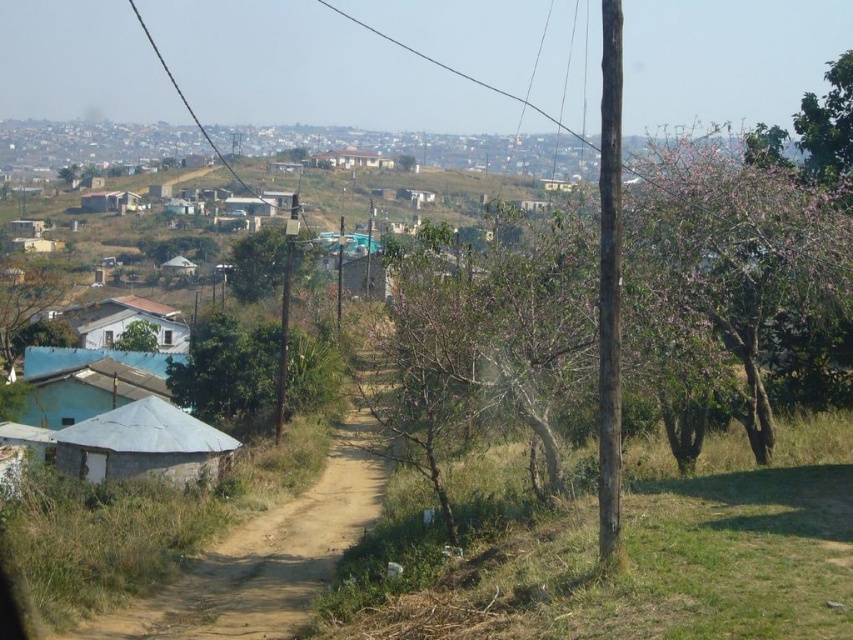
Question: Estimate the real-world distances between objects in this image. Which object is closer to the green leafy tree at center?

Choices:
 (A) white corrugated metal hut at lower left
 (B) green leafy tree at lower left
 (C) white matte house at center

Answer: (C)

Question: Does green leafy tree at upper right lie in front of white matte house at center?

Choices:
 (A) no
 (B) yes

Answer: (B)

Question: Which object is closer to the camera taking this photo?

Choices:
 (A) brown dirt track at center
 (B) brown wooden telegraph pole at center

Answer: (A)

Question: Which point is closer to the camera taking this photo?

Choices:
 (A) (285, 257)
 (B) (157, 397)
 (C) (370, 499)
 (D) (822, 168)

Answer: (D)

Question: Considering the relative positions of brown dirt track at center and green leafy tree at center in the image provided, where is brown dirt track at center located with respect to green leafy tree at center?

Choices:
 (A) below
 (B) above

Answer: (A)

Question: Is white matte house at center to the right of brown wooden telegraph pole at center from the viewer's perspective?

Choices:
 (A) no
 (B) yes

Answer: (A)